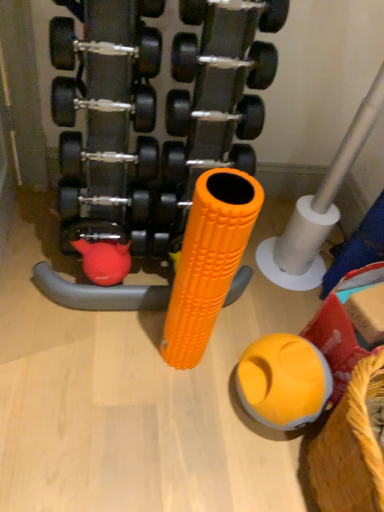
Question: Is yellow woven basket at lower right looking in the opposite direction of black rubber dumbbell at center?

Choices:
 (A) no
 (B) yes

Answer: (A)

Question: From a real-world perspective, is yellow woven basket at lower right on black rubber dumbbell at center?

Choices:
 (A) no
 (B) yes

Answer: (A)

Question: Considering the relative positions of yellow woven basket at lower right and black rubber dumbbell at center in the image provided, is yellow woven basket at lower right to the right of black rubber dumbbell at center from the viewer's perspective?

Choices:
 (A) yes
 (B) no

Answer: (A)

Question: Is yellow woven basket at lower right aimed at black rubber dumbbell at center?

Choices:
 (A) yes
 (B) no

Answer: (B)

Question: Considering the relative positions of yellow woven basket at lower right and black rubber dumbbell at center in the image provided, is yellow woven basket at lower right in front of black rubber dumbbell at center?

Choices:
 (A) yes
 (B) no

Answer: (B)

Question: Is black rubber dumbbell at center bigger or smaller than rubberized yellow ball at lower right?

Choices:
 (A) big
 (B) small

Answer: (A)

Question: Is point (135, 239) positioned closer to the camera than point (314, 370)?

Choices:
 (A) farther
 (B) closer

Answer: (A)

Question: In the image, is black rubber dumbbell at center positioned in front of or behind rubberized yellow ball at lower right?

Choices:
 (A) behind
 (B) front

Answer: (B)

Question: In terms of width, does black rubber dumbbell at center look wider or thinner when compared to rubberized yellow ball at lower right?

Choices:
 (A) thin
 (B) wide

Answer: (B)

Question: Based on their sizes in the image, would you say rubberized yellow ball at lower right is bigger or smaller than yellow woven basket at lower right?

Choices:
 (A) big
 (B) small

Answer: (B)

Question: From a real-world perspective, is rubberized yellow ball at lower right above or below yellow woven basket at lower right?

Choices:
 (A) above
 (B) below

Answer: (B)

Question: Is rubberized yellow ball at lower right wider or thinner than yellow woven basket at lower right?

Choices:
 (A) thin
 (B) wide

Answer: (A)

Question: From the image's perspective, relative to yellow woven basket at lower right, is rubberized yellow ball at lower right above or below?

Choices:
 (A) above
 (B) below

Answer: (A)

Question: In the image, is yellow woven basket at lower right positioned in front of or behind silver metallic pipe at center right?

Choices:
 (A) behind
 (B) front

Answer: (B)

Question: In terms of width, does yellow woven basket at lower right look wider or thinner when compared to silver metallic pipe at center right?

Choices:
 (A) wide
 (B) thin

Answer: (B)